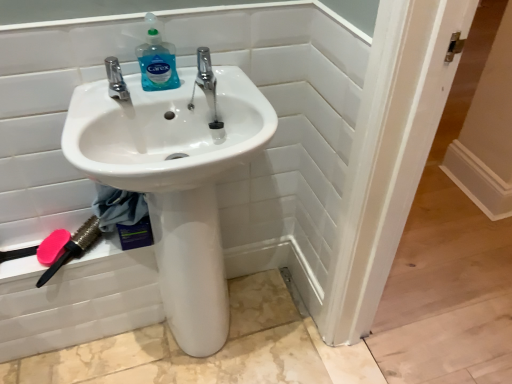
Measure the distance between point (184, 318) and camera.

The distance of point (184, 318) from camera is 1.27 meters.

At what (x,y) coordinates should I click in order to perform the action: click on white glossy sink at center. Please return your answer as a coordinate pair (x, y). Looking at the image, I should click on (175, 180).

Describe the element at coordinates (52, 247) in the screenshot. I see `pink matte brush at lower left` at that location.

Identify the location of translucent plastic bottle at upper center. (157, 60).

Where is `polished chrome tap at upper left, which is the 2th tap from right to left`? polished chrome tap at upper left, which is the 2th tap from right to left is located at coordinates (116, 79).

Which is more distant, (170, 80) or (197, 266)?

The point (197, 266) is farther.

Is translucent plastic bottle at upper center oriented towards white glossy sink at center?

No, translucent plastic bottle at upper center is not oriented towards white glossy sink at center.

Would you say translucent plastic bottle at upper center is a long distance from white glossy sink at center?

No, there isn't a large distance between translucent plastic bottle at upper center and white glossy sink at center.

Between translucent plastic bottle at upper center and white glossy sink at center, which one has more height?

white glossy sink at center.

From their relative heights in the image, would you say pink plastic brush at lower left is taller or shorter than polished chrome tap at center, which ranks as the 2th tap in left-to-right order?

Clearly, pink plastic brush at lower left is shorter compared to polished chrome tap at center, which ranks as the 2th tap in left-to-right order.

Is pink plastic brush at lower left oriented towards polished chrome tap at center, which ranks as the 2th tap in left-to-right order?

No, pink plastic brush at lower left is not turned towards polished chrome tap at center, which ranks as the 2th tap in left-to-right order.

How distant is pink plastic brush at lower left from polished chrome tap at center, which ranks as the 2th tap in left-to-right order?

pink plastic brush at lower left and polished chrome tap at center, which ranks as the 2th tap in left-to-right order, are 20.45 inches apart.

From a real-world perspective, is pink plastic brush at lower left physically above polished chrome tap at center, the 1th tap positioned from the right?

Actually, pink plastic brush at lower left is physically below polished chrome tap at center, the 1th tap positioned from the right, in the real world.

The image size is (512, 384). I want to click on cleaning product in front of the pink plastic brush at lower left, so click(157, 60).

Who is shorter, pink plastic brush at lower left or translucent plastic bottle at upper center?

pink plastic brush at lower left is shorter.

Which is in front, pink plastic brush at lower left or translucent plastic bottle at upper center?

translucent plastic bottle at upper center is more forward.

Is translucent plastic bottle at upper center at the back of pink plastic brush at lower left?

pink plastic brush at lower left is not turned away from translucent plastic bottle at upper center.

Considering the sizes of polished chrome tap at center, the 1th tap positioned from the right, and white glossy sink at center in the image, is polished chrome tap at center, the 1th tap positioned from the right, taller or shorter than white glossy sink at center?

polished chrome tap at center, the 1th tap positioned from the right, is shorter than white glossy sink at center.

Which object is positioned more to the left, polished chrome tap at center, the 1th tap positioned from the right, or white glossy sink at center?

white glossy sink at center is more to the left.

Measure the distance between polished chrome tap at center, the 1th tap positioned from the right, and white glossy sink at center.

polished chrome tap at center, the 1th tap positioned from the right, is 10.62 inches from white glossy sink at center.

From the image's perspective, is white glossy sink at center located beneath white glossy sink at center?

Yes, from the image's perspective, white glossy sink at center is below white glossy sink at center.

Who is bigger, white glossy sink at center or white glossy sink at center?

Bigger between the two is white glossy sink at center.

Looking at their sizes, would you say white glossy sink at center is wider or thinner than white glossy sink at center?

Clearly, white glossy sink at center has more width compared to white glossy sink at center.

Are white glossy sink at center and white glossy sink at center beside each other?

No.

Is polished chrome tap at upper left, positioned as the 1th tap in left-to-right order, beside pink matte brush at lower left?

No, polished chrome tap at upper left, positioned as the 1th tap in left-to-right order, is not beside pink matte brush at lower left.

From the image's perspective, is polished chrome tap at upper left, which is the 2th tap from right to left, positioned above or below pink matte brush at lower left?

polished chrome tap at upper left, which is the 2th tap from right to left, is above pink matte brush at lower left.

Identify the location of tap that is the 1st one when counting rightward from the pink matte brush at lower left. The height and width of the screenshot is (384, 512). (116, 79).

Looking at their sizes, would you say polished chrome tap at upper left, positioned as the 1th tap in left-to-right order, is wider or thinner than pink matte brush at lower left?

polished chrome tap at upper left, positioned as the 1th tap in left-to-right order, is thinner than pink matte brush at lower left.

Does polished chrome tap at upper left, which is the 2th tap from right to left, appear on the right side of pink plastic brush at lower left?

Yes.

Does polished chrome tap at upper left, which is the 2th tap from right to left, have a smaller size compared to pink plastic brush at lower left?

Yes, polished chrome tap at upper left, which is the 2th tap from right to left, is smaller than pink plastic brush at lower left.

Is polished chrome tap at upper left, which is the 2th tap from right to left, oriented away from pink plastic brush at lower left?

No.

Considering the points (111, 64) and (91, 236), which point is in front, point (111, 64) or point (91, 236)?

The point (111, 64) is more forward.

Locate an element on the screen. sink below the translucent plastic bottle at upper center (from the image's perspective) is located at coordinates (175, 180).

From a real-world perspective, which tap is the 1st one above the pink plastic brush at lower left? Please provide its 2D coordinates.

[(206, 83)]

Based on the photo, when comparing their distances from pink matte brush at lower left, does white glossy sink at center or translucent plastic bottle at upper center seem further?

translucent plastic bottle at upper center.

Based on their spatial positions, is white glossy sink at center or white glossy sink at center closer to pink plastic brush at lower left?

white glossy sink at center is closer to pink plastic brush at lower left.

Estimate the real-world distances between objects in this image. Which object is further from translucent plastic bottle at upper center, white glossy sink at center or white glossy sink at center?

white glossy sink at center is positioned further to the anchor translucent plastic bottle at upper center.

Estimate the real-world distances between objects in this image. Which object is further from polished chrome tap at center, the 1th tap positioned from the right, pink plastic brush at lower left or white glossy sink at center?

pink plastic brush at lower left.

Estimate the real-world distances between objects in this image. Which object is further from white glossy sink at center, translucent plastic bottle at upper center or pink plastic brush at lower left?

Among the two, translucent plastic bottle at upper center is located further to white glossy sink at center.

Looking at the image, which one is located closer to white glossy sink at center, white glossy sink at center or pink matte brush at lower left?

white glossy sink at center.

Which object lies further to the anchor point pink plastic brush at lower left, translucent plastic bottle at upper center or polished chrome tap at center, the 1th tap positioned from the right?

polished chrome tap at center, the 1th tap positioned from the right, is further to pink plastic brush at lower left.

From the picture: When comparing their distances from white glossy sink at center, does white glossy sink at center or translucent plastic bottle at upper center seem further?

translucent plastic bottle at upper center lies further to white glossy sink at center than the other object.

Where is `cleaning product between polished chrome tap at upper left, positioned as the 1th tap in left-to-right order, and polished chrome tap at center, which ranks as the 2th tap in left-to-right order`? cleaning product between polished chrome tap at upper left, positioned as the 1th tap in left-to-right order, and polished chrome tap at center, which ranks as the 2th tap in left-to-right order is located at coordinates (157, 60).

What are the coordinates of `soap between polished chrome tap at upper left, which is the 2th tap from right to left, and pink plastic brush at lower left, in the vertical direction` in the screenshot? It's located at (52, 247).

I want to click on bath between white glossy sink at center and pink plastic brush at lower left in the front-back direction, so click(x=285, y=135).

Find the location of `bath between pink matte brush at lower left and polished chrome tap at center, which ranks as the 2th tap in left-to-right order`. bath between pink matte brush at lower left and polished chrome tap at center, which ranks as the 2th tap in left-to-right order is located at coordinates (285, 135).